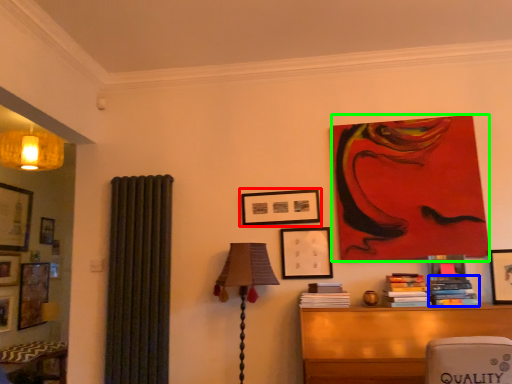
Question: Which object is the farthest from picture frame (highlighted by a red box)? Choose among these: book (highlighted by a blue box) or art (highlighted by a green box).

Choices:
 (A) book
 (B) art

Answer: (A)